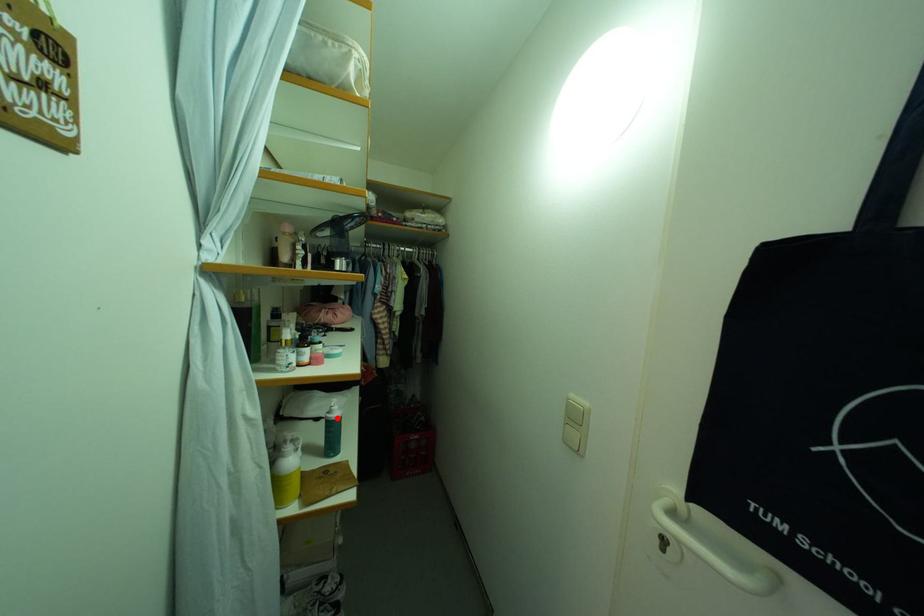
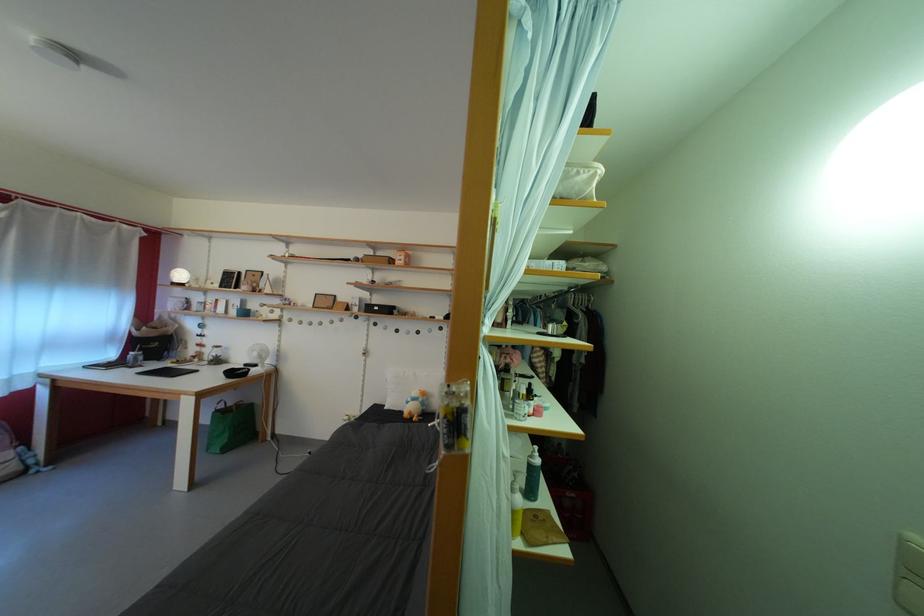
Question: I am providing you with two images of the same scene from different viewpoints. A red point is marked on the first image. Is the red point's position out of view in image 2?

Choices:
 (A) Yes
 (B) No

Answer: (B)